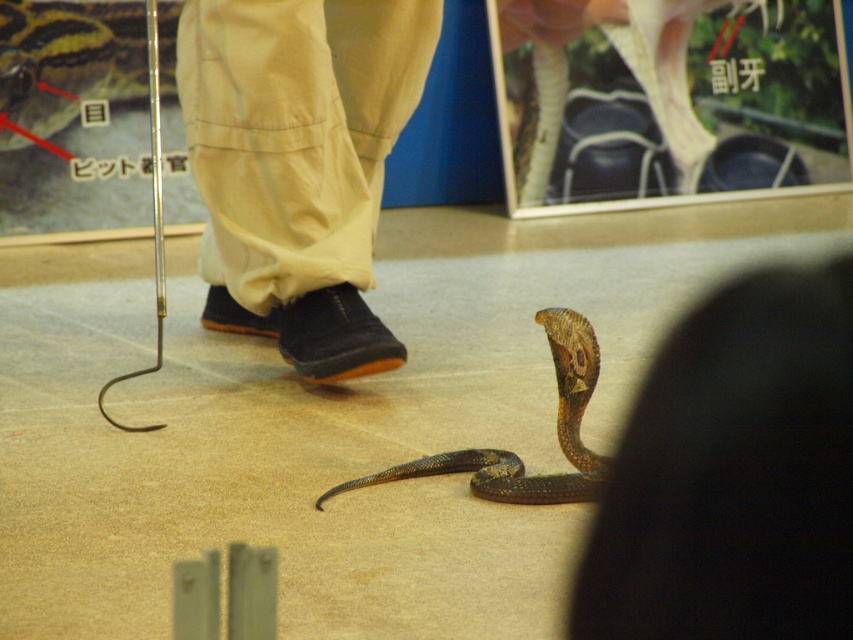
Is point (758, 483) in front of point (579, 474)?

Yes, it is.

Does matte brown snake at lower center have a smaller size compared to shiny brown snake at center?

Yes, matte brown snake at lower center is smaller than shiny brown snake at center.

Who is more forward, (590, 609) or (555, 339)?

Positioned in front is point (590, 609).

The height and width of the screenshot is (640, 853). I want to click on matte brown snake at lower center, so click(x=734, y=472).

Can you confirm if shiny white snake at center is smaller than shiny brown snake at center?

No.

Which is above, shiny white snake at center or shiny brown snake at center?

shiny white snake at center is above.

Between point (534, 186) and point (561, 396), which one is positioned behind?

Point (534, 186)

Where is `shiny white snake at center`? The image size is (853, 640). shiny white snake at center is located at coordinates (669, 72).

Does matte brown snake at lower center appear on the left side of shiny black snake at center?

No, matte brown snake at lower center is not to the left of shiny black snake at center.

Measure the distance between matte brown snake at lower center and camera.

A distance of 24.84 inches exists between matte brown snake at lower center and camera.

The image size is (853, 640). I want to click on matte brown snake at lower center, so click(734, 472).